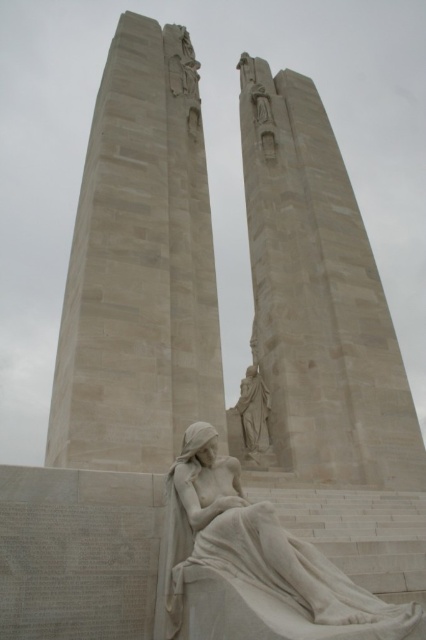
You are an architect planning to place a new sculpture between the light beige stone monument at center and the white marble statue at center. Based on their widths, which one should you position closer to the entrance to ensure the sculpture fits comfortably?

The light beige stone monument at center might be wider than the white marble statue at center, so positioning the wider monument closer to the entrance would allow more space between them for the sculpture.

You are standing in front of the war memorial and want to take a photo. You notice two points on the structure marked as point 1 at coordinates point (192, 628) and point 2 at coordinates point (259, 390). Which point will appear larger in your camera view?

Point (192, 628) is closer to the camera than point (259, 390), so it will appear larger in the camera view.

You are a tour guide explaining the layout of the monument to visitors. Pointing to the light beige stone monument at center and the white marble statue at center, you want to clarify their spatial relationship. Which one is positioned higher up?

The light beige stone monument at center is located above the white marble statue at center, so it is positioned higher up.